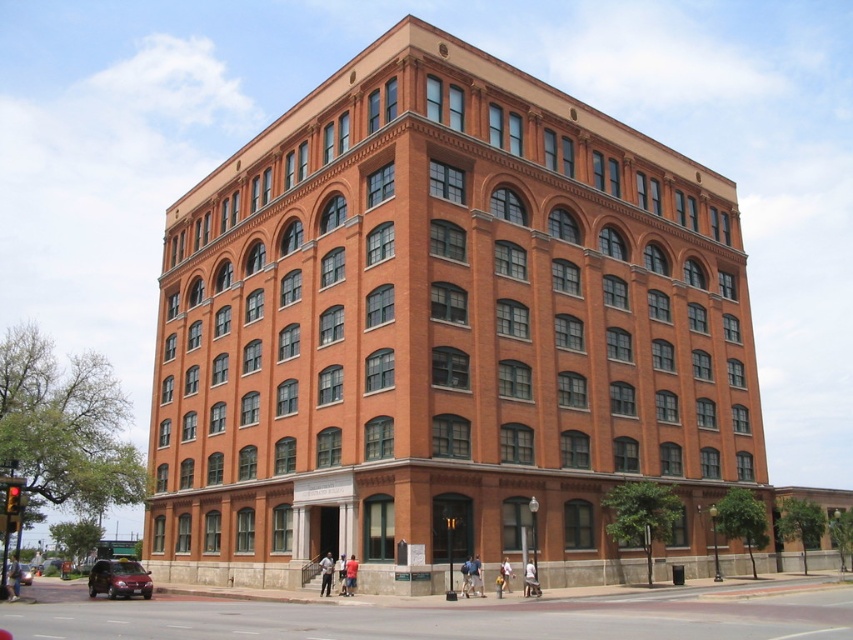
You are a delivery driver approaching the building and need to park your vehicle. You see a metallic red sedan at lower left and a shiny black sedan at lower left. Which vehicle is parked closer to the building?

The shiny black sedan at lower left is parked closer to the building because the metallic red sedan at lower left is located above it, meaning the red sedan is parked behind the black one.

You are a delivery person trying to park your van between the metallic red sedan at lower left and the shiny black sedan at lower left. The van is 2 meters wide. Can you fit your van between them?

The metallic red sedan at lower left is thinner than the shiny black sedan at lower left, but the exact distance between them isn generated from the provided information. Therefore, it is impossible to determine if the van can fit between them based on the given details.